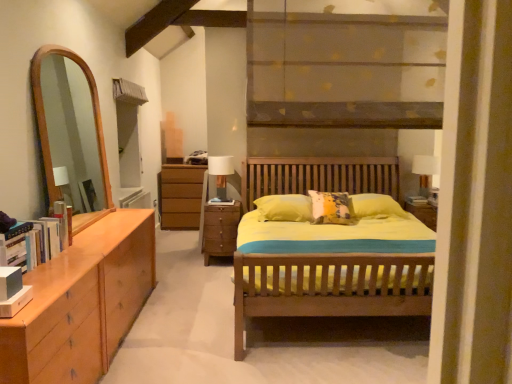
Question: From a real-world perspective, is brown wooden chest of drawers at center on matte brown wooden shelf at upper center?

Choices:
 (A) yes
 (B) no

Answer: (B)

Question: Is the depth of brown wooden chest of drawers at center less than that of matte brown wooden shelf at upper center?

Choices:
 (A) no
 (B) yes

Answer: (A)

Question: Would you say matte brown wooden shelf at upper center is part of brown wooden chest of drawers at center's contents?

Choices:
 (A) no
 (B) yes

Answer: (A)

Question: Is brown wooden chest of drawers at center further to the viewer compared to matte brown wooden shelf at upper center?

Choices:
 (A) yes
 (B) no

Answer: (A)

Question: Does brown wooden chest of drawers at center touch matte brown wooden shelf at upper center?

Choices:
 (A) yes
 (B) no

Answer: (B)

Question: In the image, is white glossy table lamp at right, positioned as the second table lamp in left-to-right order, on the left side or the right side of matte white table lamp at center, the first table lamp in the left-to-right sequence?

Choices:
 (A) left
 (B) right

Answer: (B)

Question: Would you say white glossy table lamp at right, positioned as the second table lamp in left-to-right order, is inside or outside matte white table lamp at center, arranged as the second table lamp when viewed from the right?

Choices:
 (A) outside
 (B) inside

Answer: (A)

Question: From the image's perspective, is white glossy table lamp at right, placed as the first table lamp when sorted from right to left, positioned above or below matte white table lamp at center, arranged as the second table lamp when viewed from the right?

Choices:
 (A) above
 (B) below

Answer: (B)

Question: Relative to matte white table lamp at center, the first table lamp in the left-to-right sequence, is white glossy table lamp at right, placed as the first table lamp when sorted from right to left, in front or behind?

Choices:
 (A) behind
 (B) front

Answer: (A)

Question: In the image, is brown wooden chest of drawers at center positioned in front of or behind matte white table lamp at center, arranged as the second table lamp when viewed from the right?

Choices:
 (A) front
 (B) behind

Answer: (A)

Question: Is brown wooden chest of drawers at center wider or thinner than matte white table lamp at center, arranged as the second table lamp when viewed from the right?

Choices:
 (A) wide
 (B) thin

Answer: (A)

Question: Is brown wooden chest of drawers at center bigger or smaller than matte white table lamp at center, the first table lamp in the left-to-right sequence?

Choices:
 (A) small
 (B) big

Answer: (B)

Question: From the image's perspective, is brown wooden chest of drawers at center above or below matte white table lamp at center, the first table lamp in the left-to-right sequence?

Choices:
 (A) below
 (B) above

Answer: (A)

Question: Considering their positions, is matte brown wooden shelf at upper center located in front of or behind white glossy table lamp at right, positioned as the second table lamp in left-to-right order?

Choices:
 (A) behind
 (B) front

Answer: (B)

Question: Is matte brown wooden shelf at upper center to the left or to the right of white glossy table lamp at right, placed as the first table lamp when sorted from right to left, in the image?

Choices:
 (A) right
 (B) left

Answer: (B)